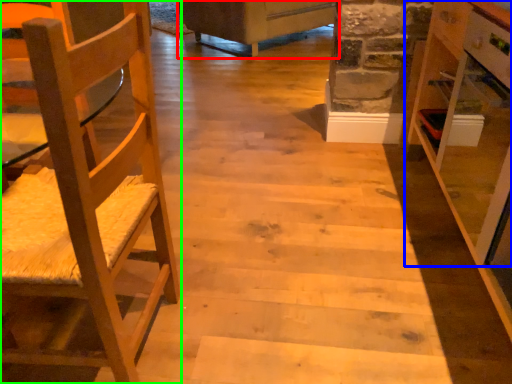
Question: Based on their relative distances, which object is nearer to furniture (highlighted by a red box)? Choose from cabinetry (highlighted by a blue box) and chair (highlighted by a green box).

Choices:
 (A) cabinetry
 (B) chair

Answer: (A)